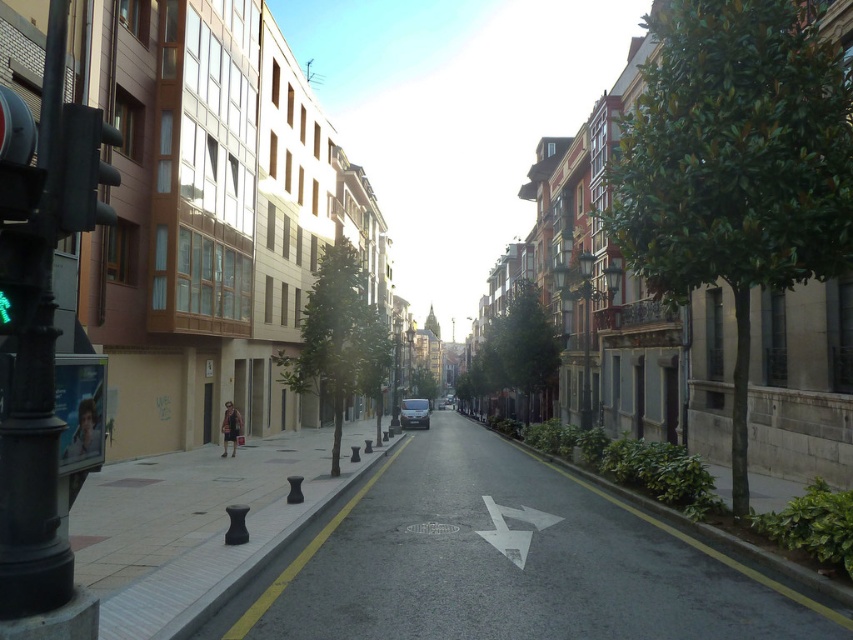
Can you confirm if matte black traffic light at left is positioned above white paper arrow at center?

Indeed, matte black traffic light at left is positioned over white paper arrow at center.

Does point (65, 116) come closer to viewer compared to point (497, 531)?

That is True.

Between point (86, 148) and point (543, 515), which one is positioned in front?

Positioned in front is point (86, 148).

Where is `matte black traffic light at left`? matte black traffic light at left is located at coordinates (84, 168).

Which of these two, matte black traffic light at left or black rubber bollards at center, stands shorter?

Standing shorter between the two is matte black traffic light at left.

Is matte black traffic light at left positioned in front of black rubber bollards at center?

Yes.

The height and width of the screenshot is (640, 853). What are the coordinates of `matte black traffic light at left` in the screenshot? It's located at (84, 168).

Identify the location of matte black traffic light at left. This screenshot has width=853, height=640. point(84,168).

Is smooth concrete pavement at center closer to the viewer compared to white paper arrow at center?

Yes, it is in front of white paper arrow at center.

Is point (459, 621) positioned after point (480, 499)?

No, it is in front of (480, 499).

Image resolution: width=853 pixels, height=640 pixels. Find the location of `smooth concrete pavement at center`. smooth concrete pavement at center is located at coordinates (508, 563).